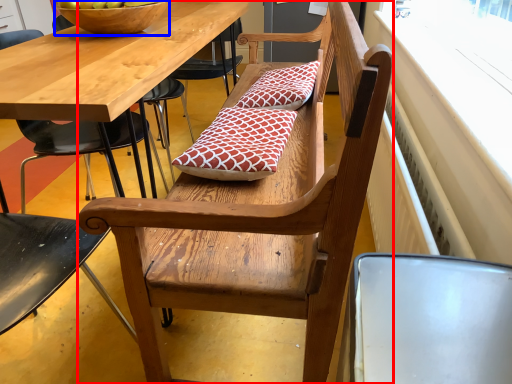
Question: Among these objects, which one is farthest to the camera, bench (highlighted by a red box) or bowl (highlighted by a blue box)?

Choices:
 (A) bench
 (B) bowl

Answer: (B)